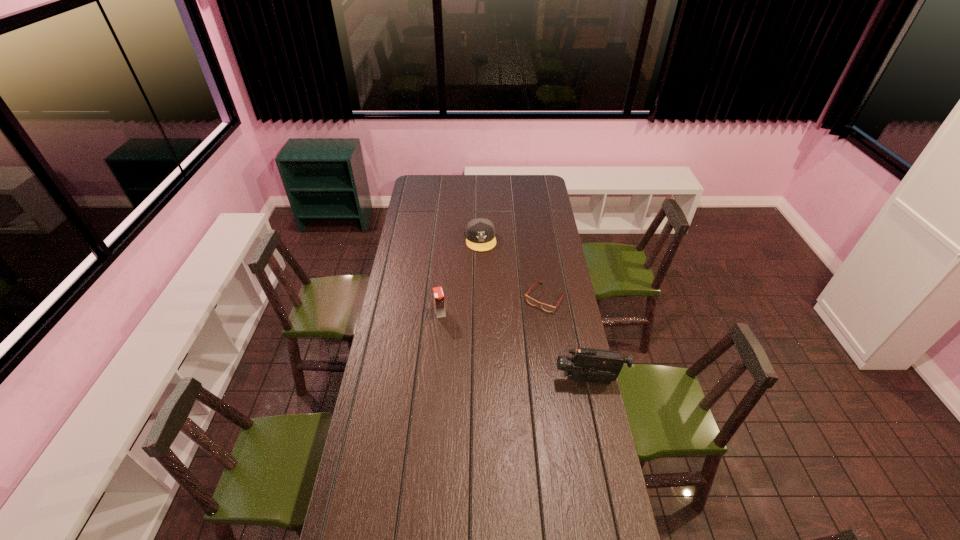
Identify the location of unoccupied position between the orange juice and the farthest object. (461, 276).

Find the location of a particular element. unoccupied position between the leftmost object and the shortest object is located at coordinates (492, 306).

The image size is (960, 540). Identify the location of vacant point located between the spectacles and the camcorder. (566, 339).

Where is `free area in between the camcorder and the spectacles`? free area in between the camcorder and the spectacles is located at coordinates (566, 339).

The width and height of the screenshot is (960, 540). Identify the location of the closest object to the spectacles. (480, 233).

The height and width of the screenshot is (540, 960). In order to click on object that stands as the second closest to the orange juice in this screenshot , I will do `click(480, 233)`.

Where is `free space that satisfies the following two spatial constraints: 1. on the front side of the second shortest object; 2. on the left side of the shortest object`? This screenshot has height=540, width=960. free space that satisfies the following two spatial constraints: 1. on the front side of the second shortest object; 2. on the left side of the shortest object is located at coordinates (481, 299).